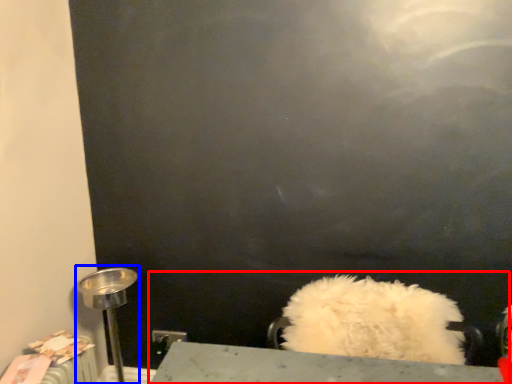
Question: Which object appears farthest to the camera in this image, sink (highlighted by a red box) or table lamp (highlighted by a blue box)?

Choices:
 (A) sink
 (B) table lamp

Answer: (B)